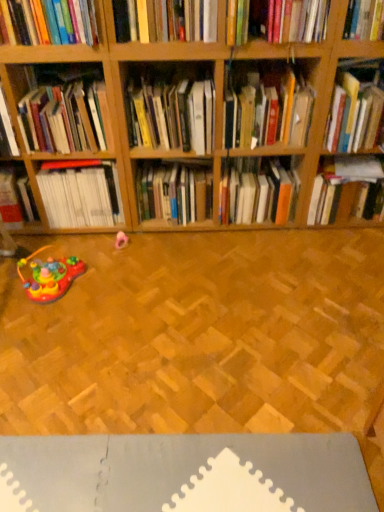
This screenshot has height=512, width=384. Find the location of `free spot behind gray foam mat at lower center`. free spot behind gray foam mat at lower center is located at coordinates (192, 335).